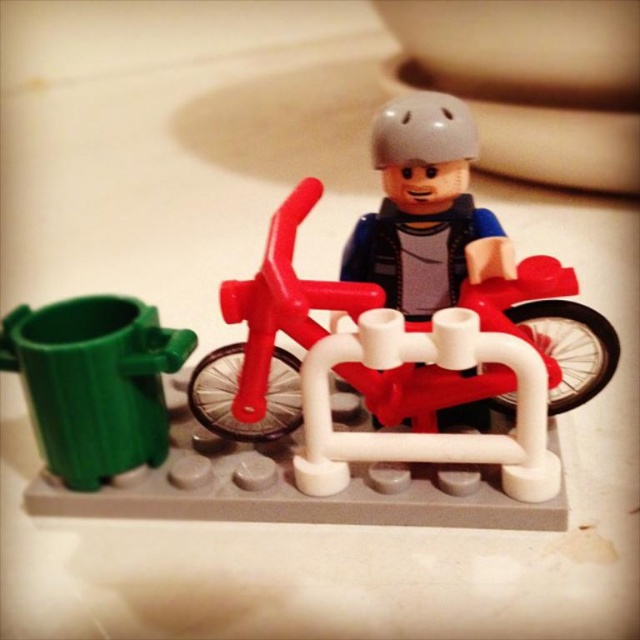
Between matte plastic bicycle at center and green plastic trash can at left, which one has more height?

Standing taller between the two is matte plastic bicycle at center.

How much distance is there between matte plastic bicycle at center and green plastic trash can at left?

They are 6.31 inches apart.

Which is in front, point (522, 520) or point (106, 324)?

Point (522, 520) is more forward.

Locate an element on the screen. The height and width of the screenshot is (640, 640). matte plastic bicycle at center is located at coordinates (360, 412).

The height and width of the screenshot is (640, 640). Identify the location of matte plastic bicycle at center. (360, 412).

Is point (177, 483) closer to camera compared to point (496, 278)?

That is False.

I want to click on matte plastic bicycle at center, so click(360, 412).

Is matte red motorcycle at center wider than green plastic trash can at left?

Yes, matte red motorcycle at center is wider than green plastic trash can at left.

Can you confirm if matte red motorcycle at center is shorter than green plastic trash can at left?

No.

Who is more distant from viewer, (x=212, y=401) or (x=86, y=355)?

The point (x=212, y=401) is more distant.

Image resolution: width=640 pixels, height=640 pixels. Find the location of `matte red motorcycle at center`. matte red motorcycle at center is located at coordinates (269, 333).